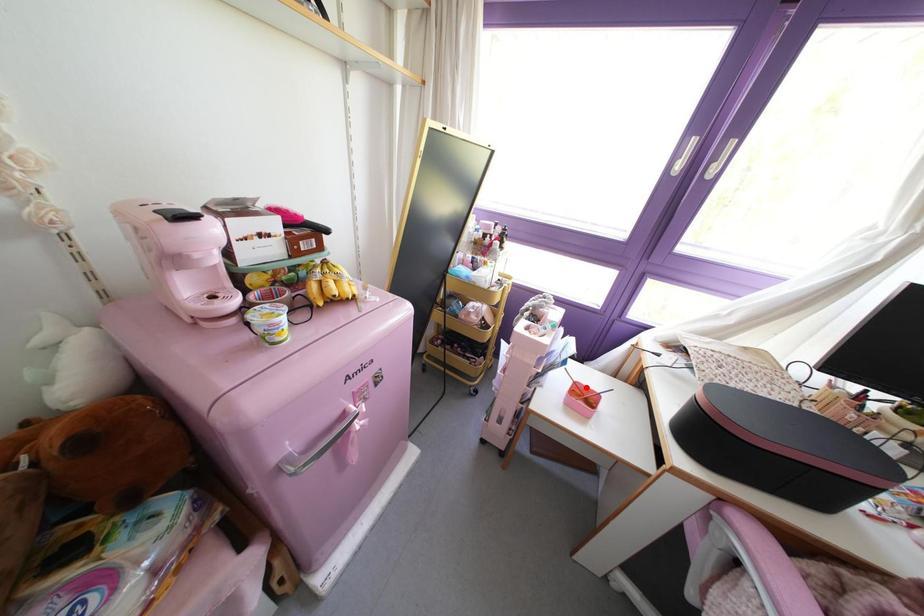
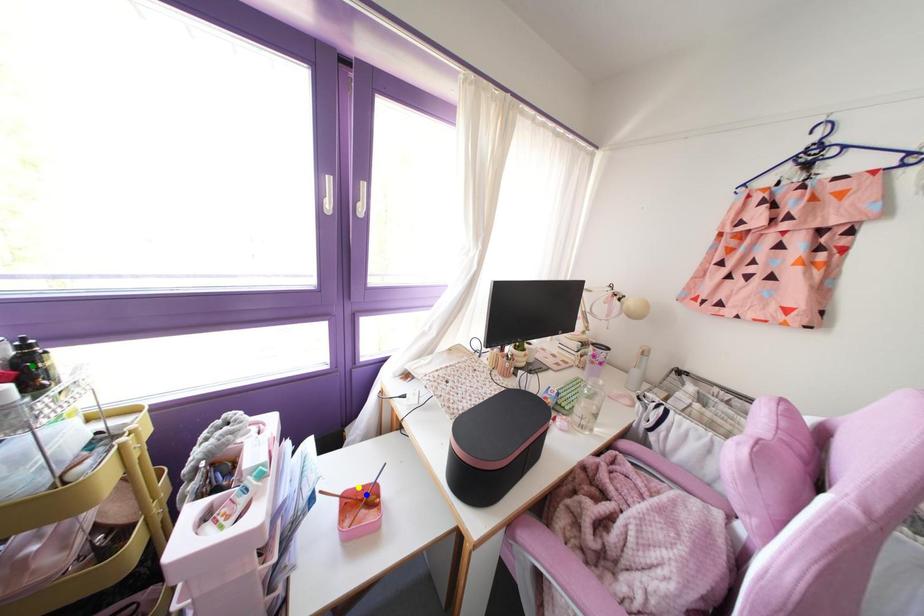
Question: I am providing you with two images of the same scene from different viewpoints. A red point is marked on the first image. You are given multiple points on the second image. In image 2, which mark is for the same physical point as the one in image 1?

Choices:
 (A) green point
 (B) blue point
 (C) yellow point

Answer: (C)